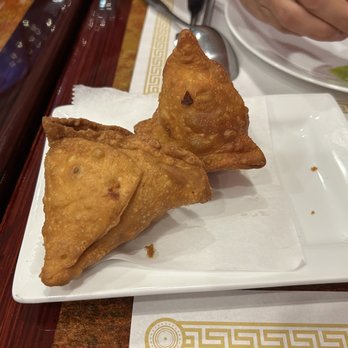
Find the location of a particular element. square plate is located at coordinates (300, 201).